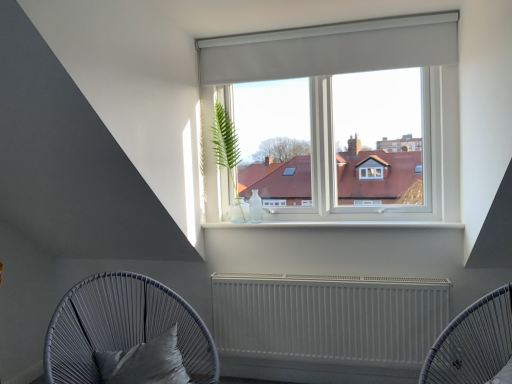
Where is `empty space that is ontop of green leafy plant in glass vase at upper left (from a real-world perspective)`? Image resolution: width=512 pixels, height=384 pixels. empty space that is ontop of green leafy plant in glass vase at upper left (from a real-world perspective) is located at coordinates (228, 88).